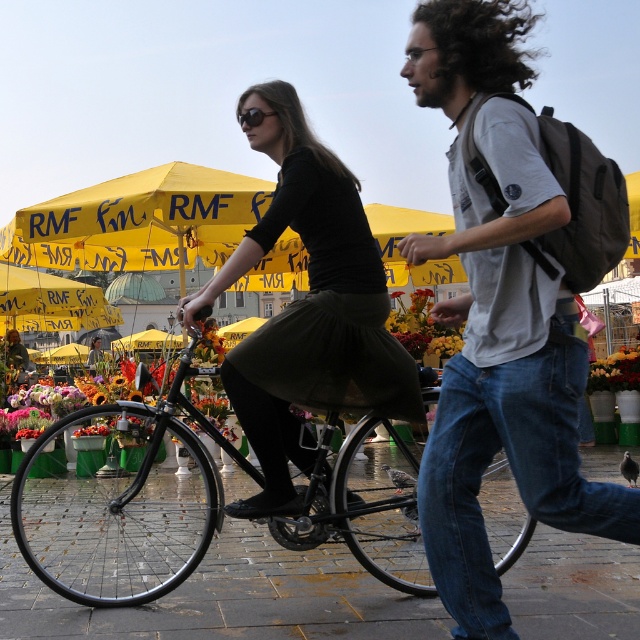
You are standing at the center of the scene and want to reach both the denim jeans at center and the vibrant floral bouquet at center. Which one is closer to you?

Both the denim jeans at center and the vibrant floral bouquet at center are at the same distance from you since they are both at the center of the scene.

You are standing in the market square and see both the denim jeans at center and the black matte dress at center. Which item is nearer to you?

The denim jeans at center is closer to the viewer than the black matte dress at center.

You are standing at the center of the scene and want to pick up the vibrant floral bouquet at center without moving from your current position. Is the shiny black bicycle at center in your way?

The shiny black bicycle at center is 4.59 meters away from the vibrant floral bouquet at center. Since you are at the center, the bicycle is between you and the bouquet, so it is blocking your path. You cannot reach the bouquet without moving.